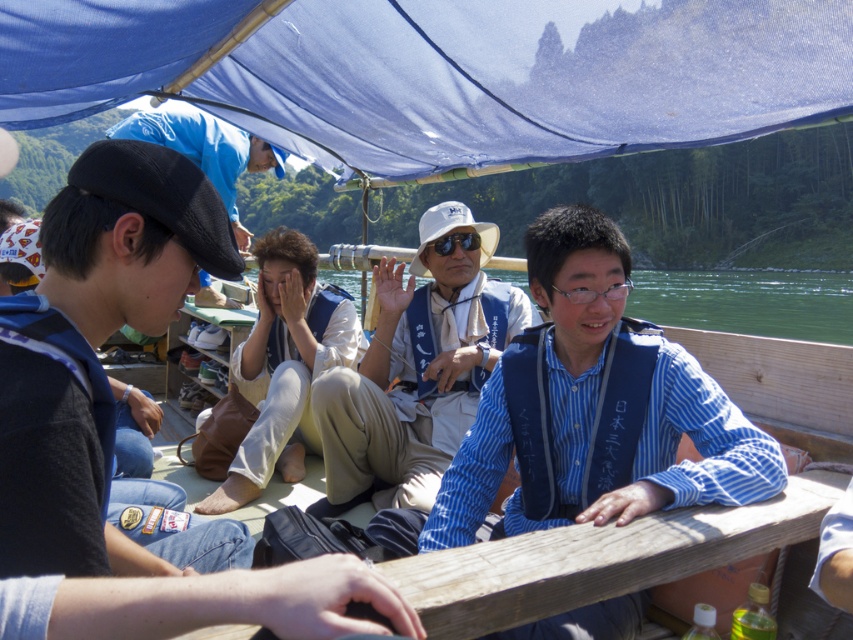
You are on a boat and want to know if the blue fabric canopy at upper center can cover the white cotton shirt at center completely. Based on their sizes, can it?

The blue fabric canopy at upper center is wider than the white cotton shirt at center, so it can cover the white cotton shirt at center completely.

You are on a wooden boat under a blue canopy and need to find a place to sit. Which object, the blue fabric canopy at upper center or the dark blue denim jeans at left, provides more coverage area for shade?

The blue fabric canopy at upper center has a larger size compared to dark blue denim jeans at left, so it provides more coverage area for shade.